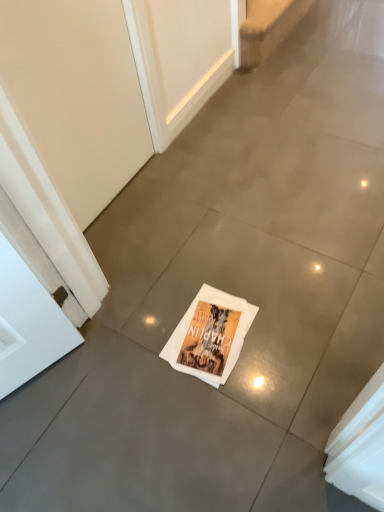
Question: Is beige carpet at upper center taller than white paper magazine at center?

Choices:
 (A) yes
 (B) no

Answer: (A)

Question: From a real-world perspective, is beige carpet at upper center positioned over white paper magazine at center based on gravity?

Choices:
 (A) yes
 (B) no

Answer: (A)

Question: Considering the relative sizes of beige carpet at upper center and white paper magazine at center in the image provided, is beige carpet at upper center smaller than white paper magazine at center?

Choices:
 (A) yes
 (B) no

Answer: (B)

Question: From the image's perspective, is beige carpet at upper center beneath white paper magazine at center?

Choices:
 (A) no
 (B) yes

Answer: (A)

Question: Is white paper magazine at center surrounded by beige carpet at upper center?

Choices:
 (A) yes
 (B) no

Answer: (B)

Question: Is white paper magazine at center wider or thinner than beige matte screen door at upper left?

Choices:
 (A) wide
 (B) thin

Answer: (A)

Question: Is point (213, 373) positioned closer to the camera than point (94, 214)?

Choices:
 (A) farther
 (B) closer

Answer: (B)

Question: From a real-world perspective, is white paper magazine at center physically located above or below beige matte screen door at upper left?

Choices:
 (A) above
 (B) below

Answer: (B)

Question: In the image, is white paper magazine at center on the left side or the right side of beige matte screen door at upper left?

Choices:
 (A) right
 (B) left

Answer: (A)

Question: From the image's perspective, is white paper magazine at center located above or below beige carpet at upper center?

Choices:
 (A) above
 (B) below

Answer: (B)

Question: Considering the positions of white paper magazine at center and beige carpet at upper center in the image, is white paper magazine at center taller or shorter than beige carpet at upper center?

Choices:
 (A) short
 (B) tall

Answer: (A)

Question: From a real-world perspective, is white paper magazine at center positioned above or below beige carpet at upper center?

Choices:
 (A) below
 (B) above

Answer: (A)

Question: Based on their sizes in the image, would you say white paper magazine at center is bigger or smaller than beige carpet at upper center?

Choices:
 (A) small
 (B) big

Answer: (A)

Question: Is beige carpet at upper center inside or outside of white paper magazine at center?

Choices:
 (A) outside
 (B) inside

Answer: (A)

Question: Is beige carpet at upper center in front of or behind white paper magazine at center in the image?

Choices:
 (A) front
 (B) behind

Answer: (B)